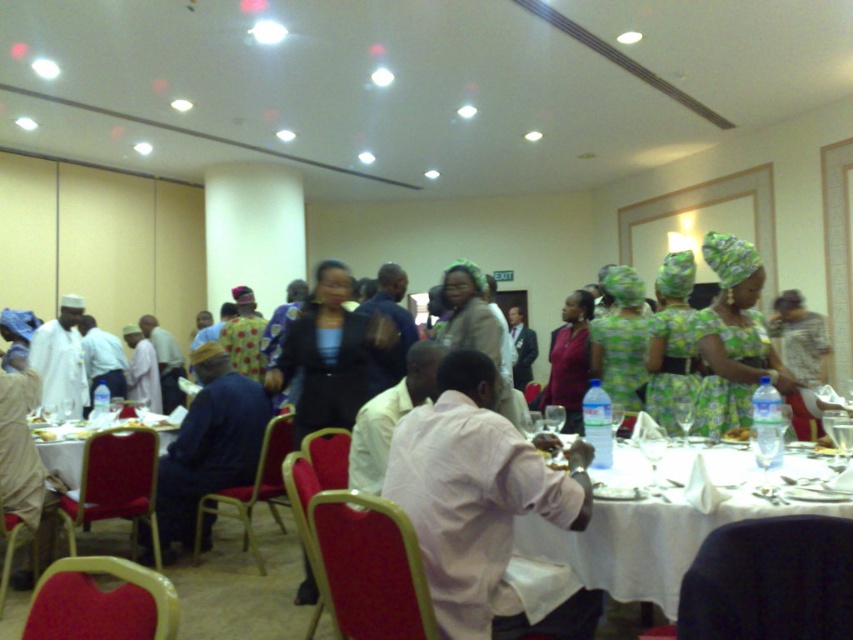
Is white matte shirt at left bigger than printed fabric dress at center?

Correct, white matte shirt at left is larger in size than printed fabric dress at center.

Is white matte shirt at left positioned in front of printed fabric dress at center?

Yes, it is.

The width and height of the screenshot is (853, 640). I want to click on white matte shirt at left, so click(x=61, y=362).

Is white cloth at center positioned before green printed dress at center?

Yes, it is.

Who is more forward, [540,554] or [706,262]?

Point [540,554]

Between point (618, 566) and point (785, 384), which one is positioned in front?

Point (618, 566)

Where is `white cloth at center`? white cloth at center is located at coordinates (657, 529).

How much distance is there between white matte shirt at center and matte pink blouse at center?

white matte shirt at center is 6.70 feet from matte pink blouse at center.

Where is `white matte shirt at center`? The height and width of the screenshot is (640, 853). white matte shirt at center is located at coordinates (483, 502).